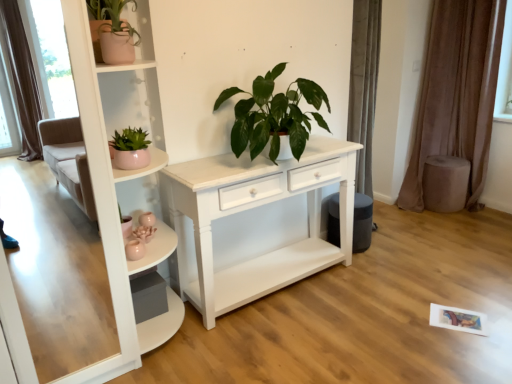
Where is `vacant area that is situated to the right of white glossy shelf at upper left`? The height and width of the screenshot is (384, 512). vacant area that is situated to the right of white glossy shelf at upper left is located at coordinates (250, 335).